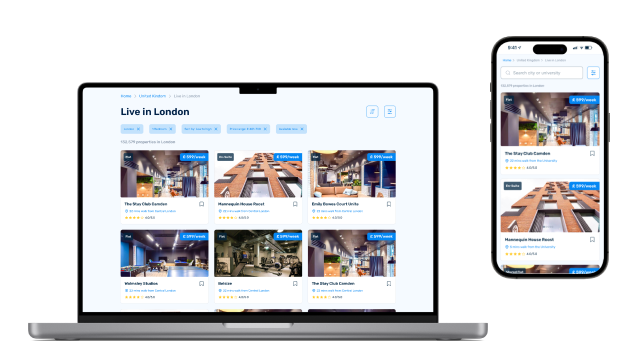
Where is `laptop`? laptop is located at coordinates (345, 114).